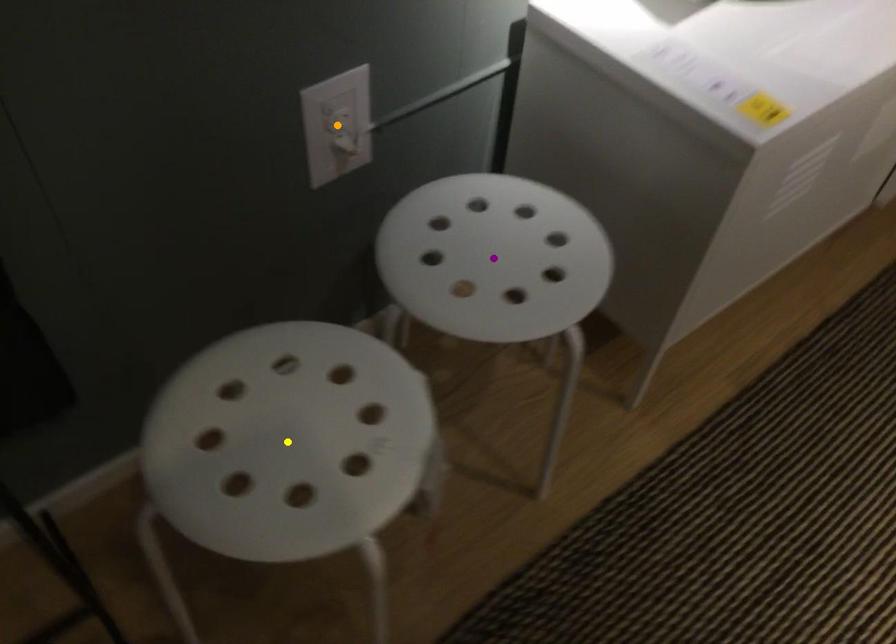
Order these from nearest to farthest:
A) yellow point
B) orange point
C) purple point

yellow point, purple point, orange point